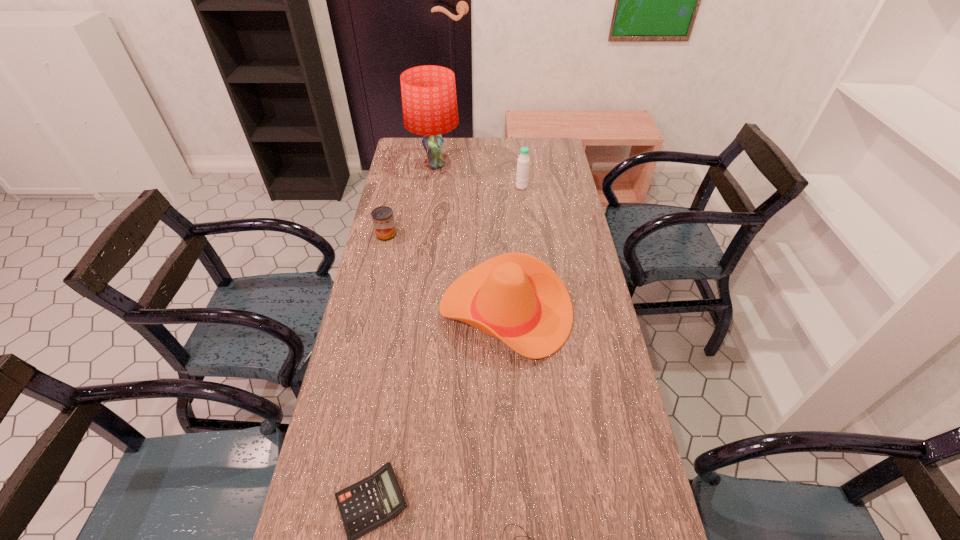
Find the location of a particular element. This screenshot has width=960, height=540. unoccupied area between the fourth tallest object and the fourth farthest object is located at coordinates (446, 273).

The height and width of the screenshot is (540, 960). I want to click on vacant space that is in between the can and the cowboy hat, so click(x=446, y=273).

Locate an element on the screen. This screenshot has height=540, width=960. object that is the fourth closest to the shortest object is located at coordinates (523, 160).

Identify which object is located as the second nearest to the tallest object. Please provide its 2D coordinates. Your answer should be formatted as a tuple, i.e. [(x, y)], where the tuple contains the x and y coordinates of a point satisfying the conditions above.

[(383, 220)]

The image size is (960, 540). I want to click on free spot that satisfies the following two spatial constraints: 1. on the back side of the fifth nearest object; 2. on the left side of the fourth farthest object, so click(499, 187).

Where is `vacant space that satisfies the following two spatial constraints: 1. on the front-facing side of the lampshade; 2. on the right side of the cowboy hat`? The width and height of the screenshot is (960, 540). vacant space that satisfies the following two spatial constraints: 1. on the front-facing side of the lampshade; 2. on the right side of the cowboy hat is located at coordinates (416, 311).